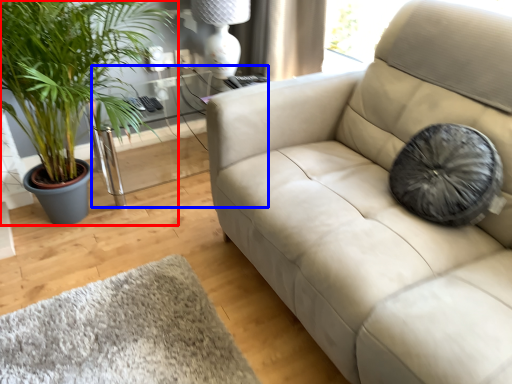
Question: Among these objects, which one is farthest to the camera, houseplant (highlighted by a red box) or table (highlighted by a blue box)?

Choices:
 (A) houseplant
 (B) table

Answer: (B)